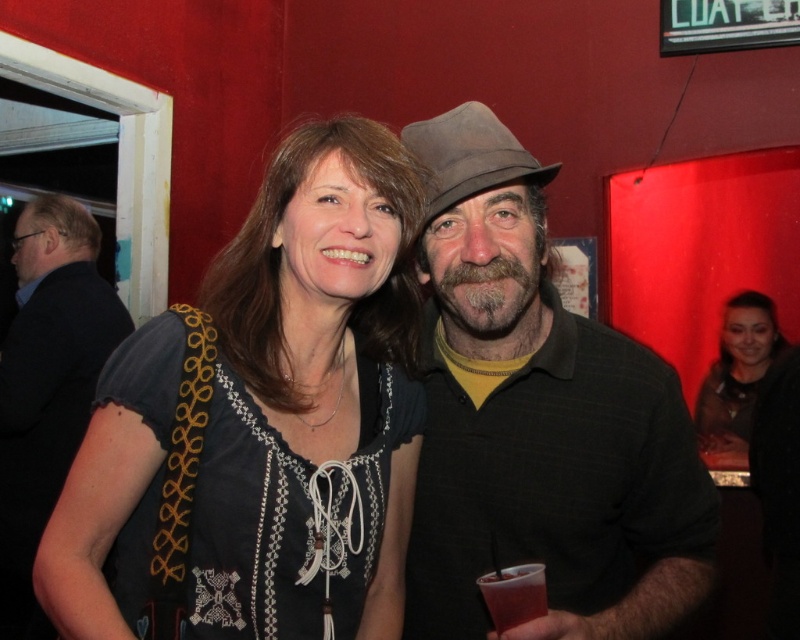
You are a photographer trying to capture a clear photo of both the dark blue embroidered shirt at center and the graywoollybeard at center. The camera has a minimum focus distance of 25 centimeters. Can you focus on both subjects simultaneously?

The dark blue embroidered shirt at center and graywoollybeard at center are 26.02 centimeters apart. Since the distance between them is greater than the camera minimum focus distance of 25 centimeters, you can focus on both subjects simultaneously.

You are standing at the point marked as point (x=514, y=253) and want to greet the woman with shoulder length brown hair. Can you reach her without moving from your current position?

The distance between you and the woman with shoulder length brown hair is 1.10 meters, so yes, you can reach her without moving from your current position.